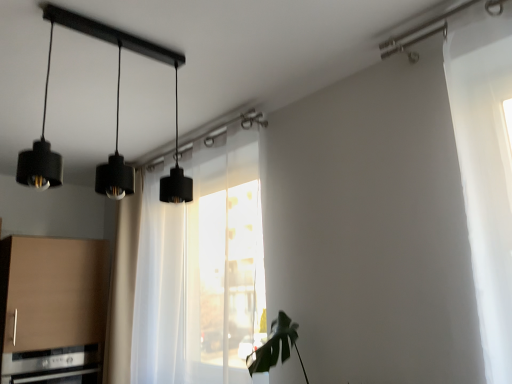
Identify the location of free spot above matte black pendant light at upper left (from a real-world perspective). (109, 29).